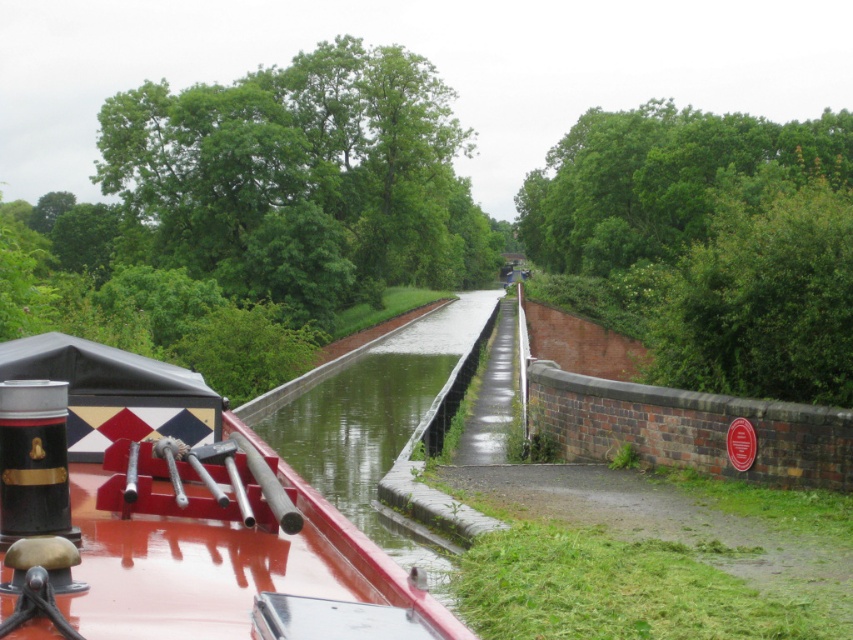
Who is more forward, (102, 497) or (366, 488)?

Point (102, 497) is more forward.

The height and width of the screenshot is (640, 853). I want to click on shiny red boat at center, so click(204, 515).

Can you confirm if green leafy tree at upper left is positioned to the left of shiny red boat at center?

Correct, you'll find green leafy tree at upper left to the left of shiny red boat at center.

Does point (379, 278) lie in front of point (283, 579)?

No, (379, 278) is behind (283, 579).

Who is more distant from viewer, (x=451, y=112) or (x=410, y=605)?

Positioned behind is point (x=451, y=112).

I want to click on green leafy tree at upper left, so click(x=300, y=179).

The image size is (853, 640). I want to click on green leafy tree at upper left, so click(x=300, y=179).